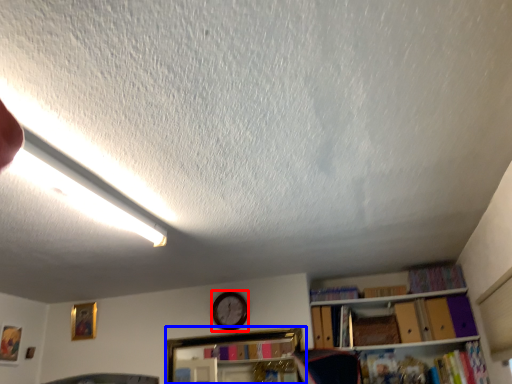
Question: Among these objects, which one is nearest to the camera, clock (highlighted by a red box) or shelf (highlighted by a blue box)?

Choices:
 (A) clock
 (B) shelf

Answer: (B)